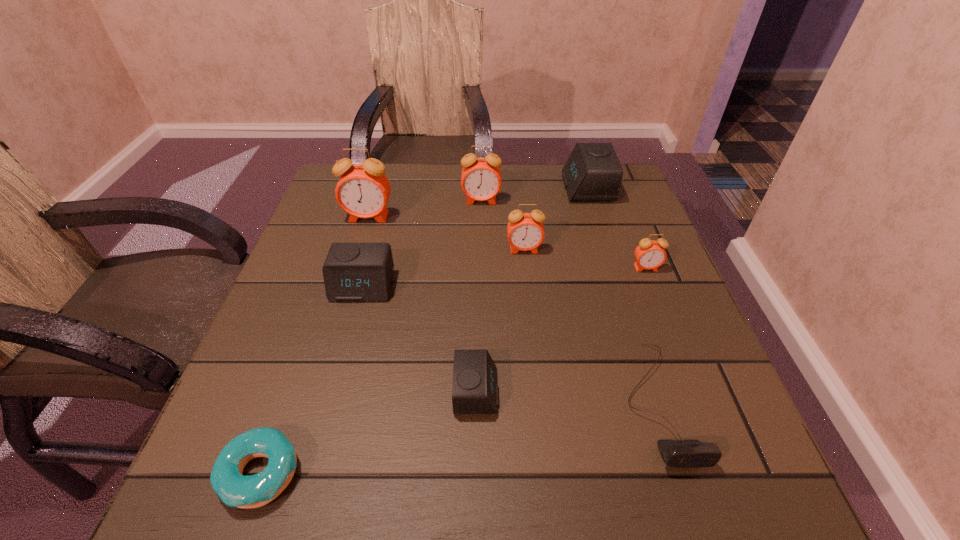
Image resolution: width=960 pixels, height=540 pixels. I want to click on vacant space that is in between the doughnut and the leftmost pink alarm clock, so click(315, 345).

The height and width of the screenshot is (540, 960). I want to click on object that ranks as the sixth closest to the webcam, so click(x=481, y=178).

I want to click on object that is the sixth closest to the fifth nearest alarm clock, so click(234, 489).

This screenshot has height=540, width=960. In order to click on alarm clock object that ranks as the fourth closest to the leftmost pink alarm clock in this screenshot , I will do `click(593, 172)`.

At what (x,y) coordinates should I click in order to perform the action: click on alarm clock identified as the closest to the nearest pink alarm clock. Please return your answer as a coordinate pair (x, y). Looking at the image, I should click on (525, 231).

Locate which pink alarm clock is the second closest to the seventh nearest object. Please provide its 2D coordinates. Your answer should be formatted as a tuple, i.e. [(x, y)], where the tuple contains the x and y coordinates of a point satisfying the conditions above.

[(525, 231)]

Locate which pink alarm clock is the second closest to the third alarm clock from right to left. Please provide its 2D coordinates. Your answer should be formatted as a tuple, i.e. [(x, y)], where the tuple contains the x and y coordinates of a point satisfying the conditions above.

[(650, 254)]

Where is `black alarm clock that is the second closest to the fifth shortest alarm clock`? black alarm clock that is the second closest to the fifth shortest alarm clock is located at coordinates coord(353,272).

This screenshot has height=540, width=960. In order to click on the second closest black alarm clock to the second farthest black alarm clock in this screenshot , I will do `click(593, 172)`.

Find the location of a particular element. free space that satisfies the following two spatial constraints: 1. on the face of the second smallest pink alarm clock; 2. on the front-facing side of the nearest alarm clock is located at coordinates 540,392.